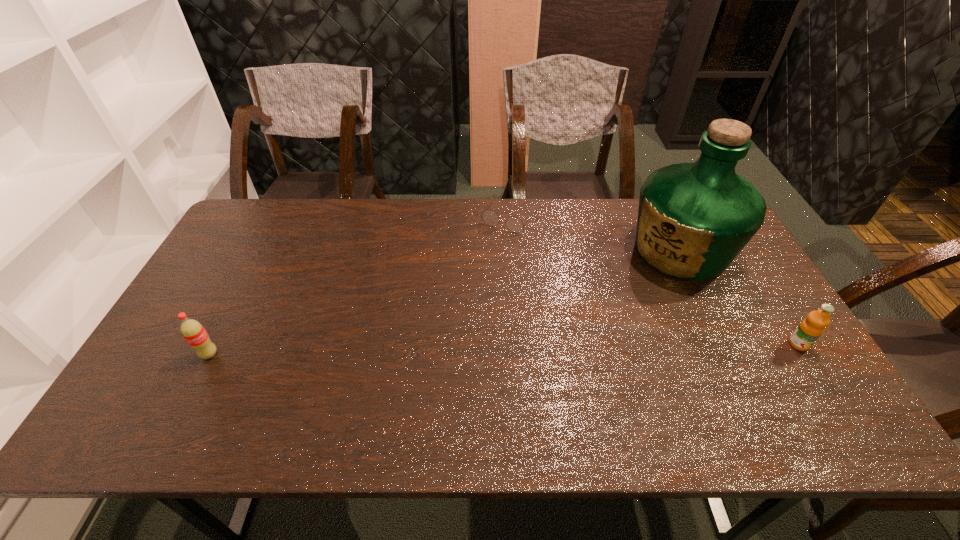
You are a GUI agent. You are given a task and a screenshot of the screen. Output one action in this format:
    pyautogui.click(x=<x>, y=<y>)
    Task: Click on the free spot at the near edge of the desktop
    This screenshot has width=960, height=540.
    Given the screenshot: What is the action you would take?
    pyautogui.click(x=558, y=399)

Find the location of `vacant region at the left edge of the desktop`. vacant region at the left edge of the desktop is located at coordinates (189, 315).

Locate an element on the screen. vacant space at the right edge of the desktop is located at coordinates (758, 326).

In order to click on blank area at the far left corner in this screenshot , I will do `click(230, 238)`.

You are a GUI agent. You are given a task and a screenshot of the screen. Output one action in this format:
    pyautogui.click(x=<x>, y=<y>)
    Task: Click on the vacant space at the near left corner
    This screenshot has width=960, height=540.
    Given the screenshot: What is the action you would take?
    pyautogui.click(x=153, y=394)

The image size is (960, 540). I want to click on free space between the tallest object and the spectacles, so click(596, 234).

Locate an element on the screen. The image size is (960, 540). free space between the soda and the spectacles is located at coordinates (361, 286).

Locate an element on the screen. The width and height of the screenshot is (960, 540). vacant area between the tallest object and the soda is located at coordinates (444, 303).

Locate an element on the screen. The width and height of the screenshot is (960, 540). vacant area that lies between the orange juice and the liquor is located at coordinates (739, 298).

Find the location of a particular element. This screenshot has height=540, width=960. free space between the tallest object and the spectacles is located at coordinates (596, 234).